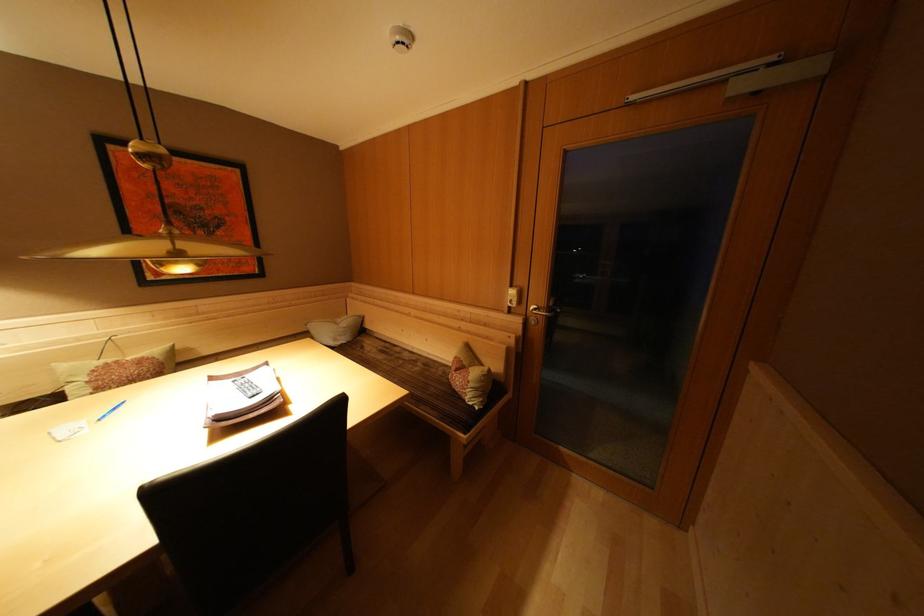
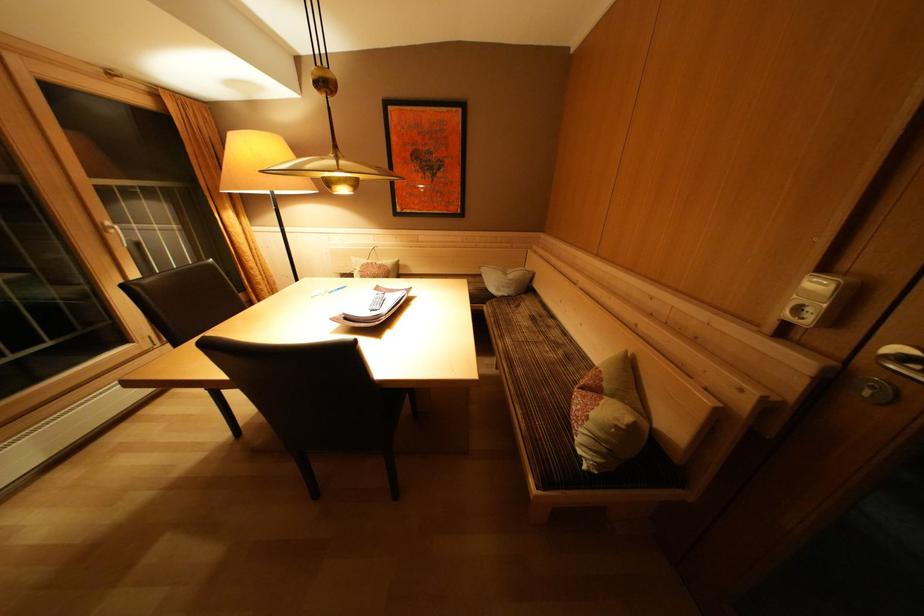
The point at (521, 310) is marked in the first image. Where is the corresponding point in the second image?

(815, 326)